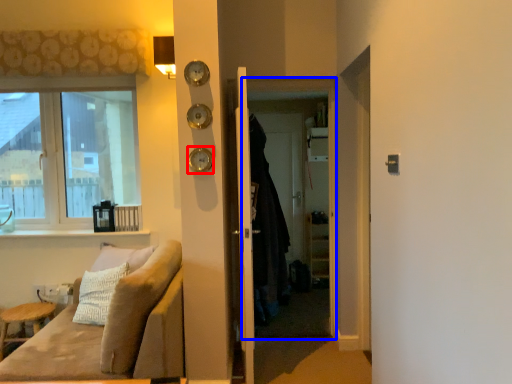
Question: Which of the following is the farthest to the observer, clock (highlighted by a red box) or screen door (highlighted by a blue box)?

Choices:
 (A) clock
 (B) screen door

Answer: (B)